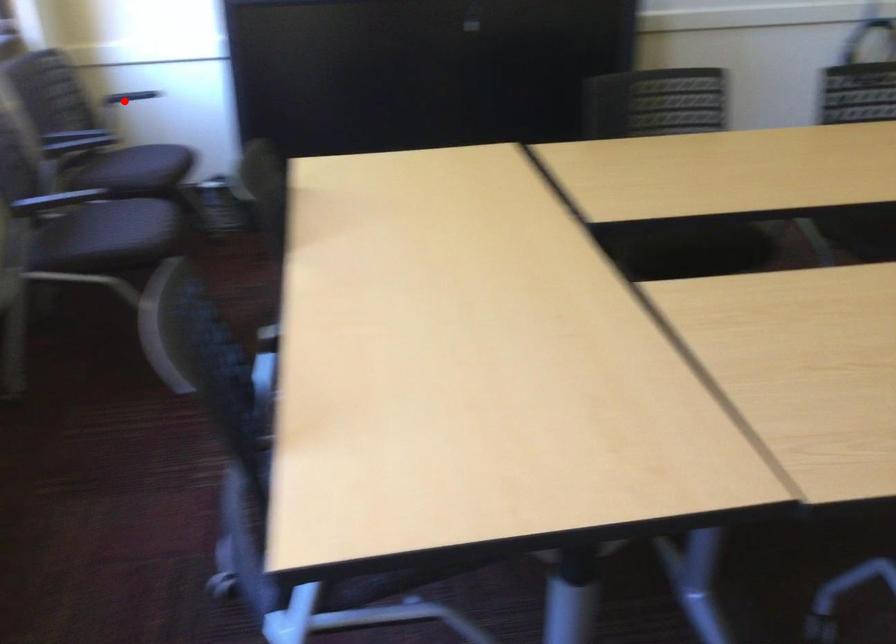
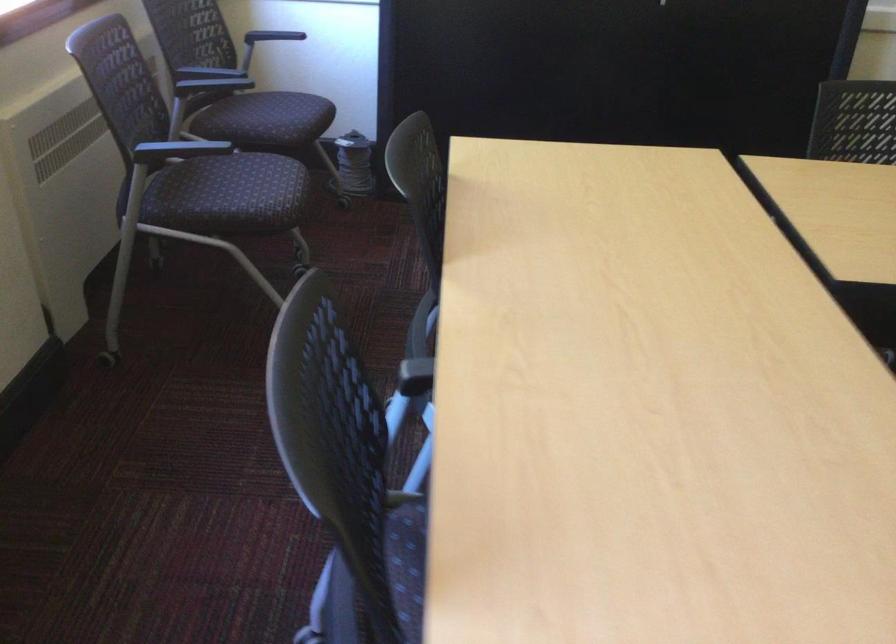
Question: I am providing you with two images of the same scene from different viewpoints. A red point is marked on the first image. At the location where the point appears in image 1, is it still visible in image 2?

Choices:
 (A) Yes
 (B) No

Answer: (A)